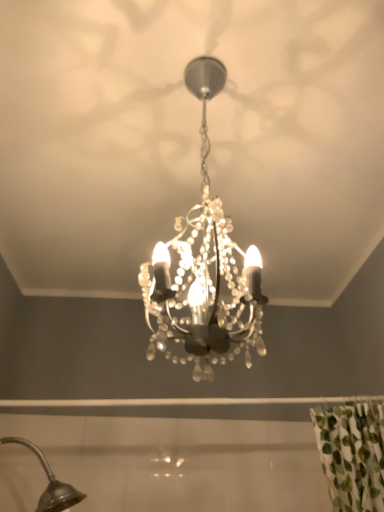
What do you see at coordinates (204, 268) in the screenshot?
I see `clear crystal chandelier at center` at bounding box center [204, 268].

Find the location of a particular element. clear crystal chandelier at center is located at coordinates (204, 268).

The image size is (384, 512). I want to click on clear crystal chandelier at center, so click(x=204, y=268).